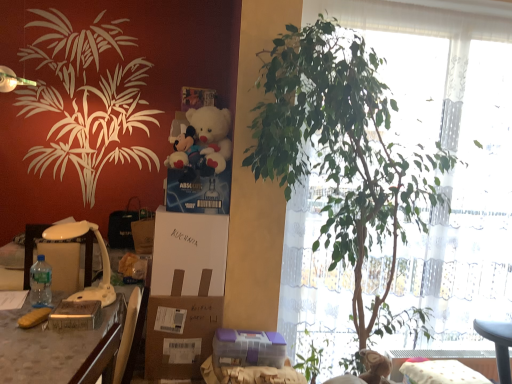
Question: Considering the relative positions of white cardboard box at center and white plastic lamp at left in the image provided, is white cardboard box at center in front of white plastic lamp at left?

Choices:
 (A) no
 (B) yes

Answer: (A)

Question: Does white cardboard box at center lie behind white plastic lamp at left?

Choices:
 (A) yes
 (B) no

Answer: (A)

Question: Considering the relative positions of white cardboard box at center and white plastic lamp at left in the image provided, is white cardboard box at center to the left of white plastic lamp at left from the viewer's perspective?

Choices:
 (A) no
 (B) yes

Answer: (A)

Question: From a real-world perspective, is white cardboard box at center below white plastic lamp at left?

Choices:
 (A) yes
 (B) no

Answer: (B)

Question: From a real-world perspective, is white cardboard box at center on top of white plastic lamp at left?

Choices:
 (A) no
 (B) yes

Answer: (B)

Question: From the image's perspective, is wooden desk at left positioned above or below brown cardboard box at center?

Choices:
 (A) above
 (B) below

Answer: (A)

Question: Is wooden desk at left in front of or behind brown cardboard box at center in the image?

Choices:
 (A) front
 (B) behind

Answer: (A)

Question: Would you say wooden desk at left is to the left or to the right of brown cardboard box at center in the picture?

Choices:
 (A) right
 (B) left

Answer: (B)

Question: Does point (108, 340) appear closer or farther from the camera than point (164, 301)?

Choices:
 (A) farther
 (B) closer

Answer: (B)

Question: Considering the positions of point (176, 317) and point (156, 299), is point (176, 317) closer or farther from the camera than point (156, 299)?

Choices:
 (A) closer
 (B) farther

Answer: (B)

Question: Which is correct: white cardboard box at center is inside brown cardboard box at center, or outside of it?

Choices:
 (A) outside
 (B) inside

Answer: (A)

Question: Considering the positions of white cardboard box at center and brown cardboard box at center in the image, is white cardboard box at center wider or thinner than brown cardboard box at center?

Choices:
 (A) thin
 (B) wide

Answer: (B)

Question: Looking at the image, does white cardboard box at center seem bigger or smaller compared to brown cardboard box at center?

Choices:
 (A) big
 (B) small

Answer: (A)

Question: From their relative heights in the image, would you say clear plastic bottle at left is taller or shorter than brown cardboard box at center?

Choices:
 (A) tall
 (B) short

Answer: (B)

Question: Choose the correct answer: Is clear plastic bottle at left inside brown cardboard box at center or outside it?

Choices:
 (A) outside
 (B) inside

Answer: (A)